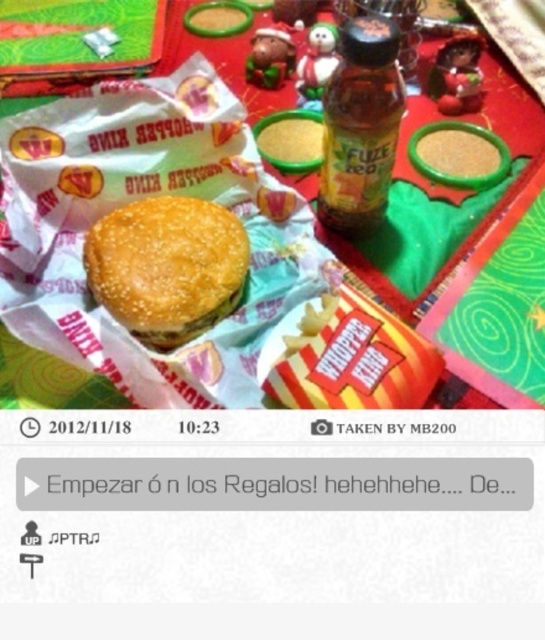
You are a guest at a holiday dinner and want to place your green matte tray at center and translucent plastic bottle at center on the table. How far apart should you place them to match the scene?

The green matte tray at center should be placed 4.78 inches away from the translucent plastic bottle at center to match the scene.

You are a guest at a holiday dinner and want to place a small ornament on the table. The ornament requires a stable surface. Which object between the green matte tray at center and the translucent plastic bottle at center would be more suitable for placing the ornament?

The green matte tray at center is much taller than the translucent plastic bottle at center, so the green matte tray at center would provide a more stable surface for placing the ornament.